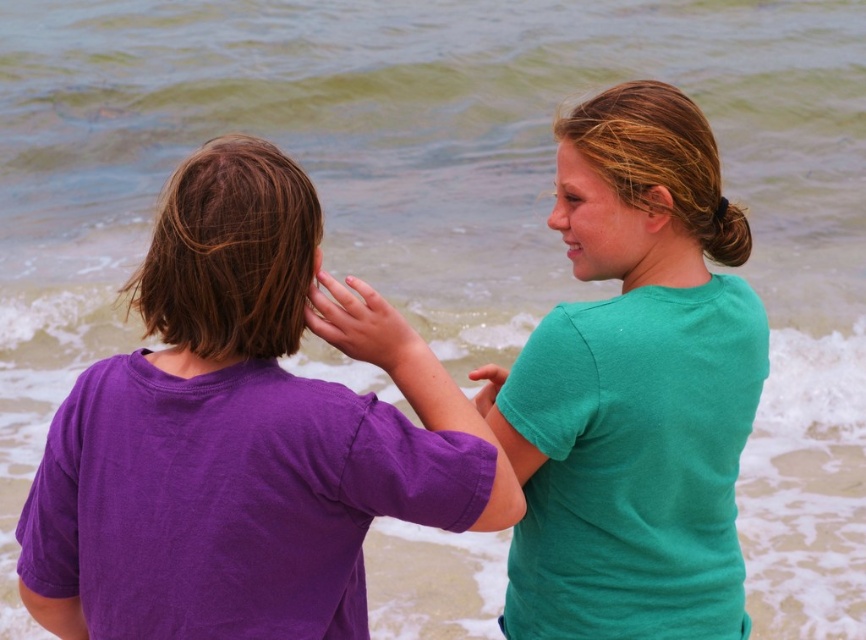
You are a photographer observing the scene. You need to capture a closeup shot of the matte green shirt at upper right without including the matte skin hand at center in the frame. Is this possible based on their positions?

The matte skin hand at center is positioned over the matte green shirt at upper right, so it would block the view. Therefore, capturing a closeup of the matte green shirt at upper right without the hand would not be possible without moving the hand or adjusting the camera angle.

You are a photographer trying to capture a candid shot of the two people in the scene. You want to ensure that the purple cotton shirt at left and the matte skin hand at center are both in focus. Since the camera can only focus on one subject at a time, which subject should you prioritize focusing on to ensure the other is also in focus, given their spatial relationship?

The purple cotton shirt at left is to the left of the matte skin hand at center. Since they are positioned close to each other, focusing on the purple cotton shirt at left would likely keep the matte skin hand at center in focus as well due to their proximity.

You are a photographer trying to capture a closeup of the purple cotton shirt at left and the green matte shirt at upper right. Which shirt should you zoom in on to ensure both shirts are in the frame without moving the camera?

The purple cotton shirt at left is wider than the green matte shirt at upper right, so zooming in on the purple cotton shirt at left will ensure both shirts remain in the frame since it is wider and likely occupies more space in the image.